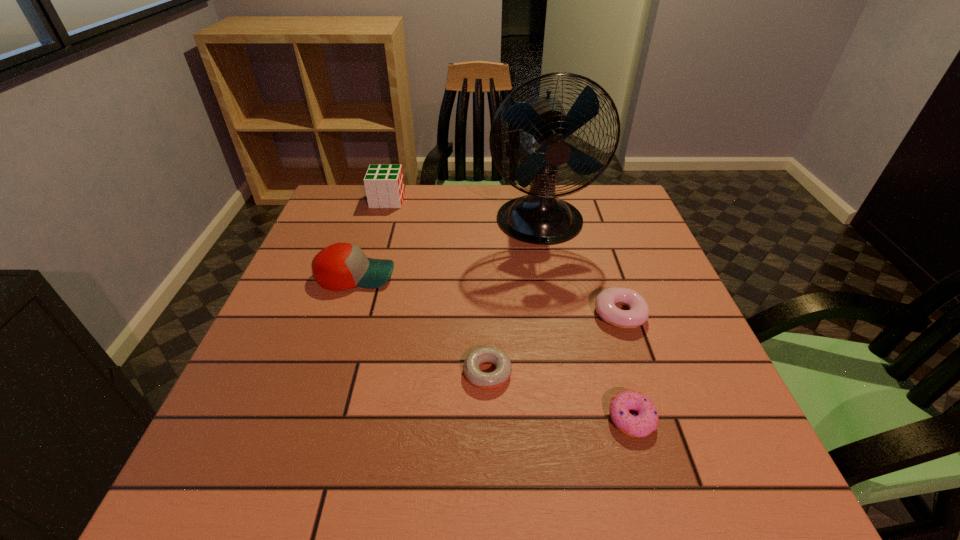
Identify the location of free space that satisfies the following two spatial constraints: 1. at the brim of the fourth shortest object; 2. on the right side of the nearest object. The height and width of the screenshot is (540, 960). (309, 418).

The width and height of the screenshot is (960, 540). Find the location of `vacant space that satisfies the following two spatial constraints: 1. on the front side of the nearest doughnut; 2. on the left side of the second nearest doughnut`. vacant space that satisfies the following two spatial constraints: 1. on the front side of the nearest doughnut; 2. on the left side of the second nearest doughnut is located at coordinates (488, 418).

The width and height of the screenshot is (960, 540). I want to click on free space in the image that satisfies the following two spatial constraints: 1. on the back side of the nearest doughnut; 2. on the red face of the cube, so click(568, 200).

At what (x,y) coordinates should I click in order to perform the action: click on free space that satisfies the following two spatial constraints: 1. on the front-facing side of the nearest object; 2. on the left side of the fan. Please return your answer as a coordinate pair (x, y). The height and width of the screenshot is (540, 960). Looking at the image, I should click on (576, 418).

Locate an element on the screen. This screenshot has height=540, width=960. vacant space that satisfies the following two spatial constraints: 1. on the front-facing side of the tallest object; 2. at the brim of the baseball cap is located at coordinates (550, 275).

Where is `free region that satisfies the following two spatial constraints: 1. at the brim of the fourth nearest object; 2. on the back side of the nearest doughnut`? free region that satisfies the following two spatial constraints: 1. at the brim of the fourth nearest object; 2. on the back side of the nearest doughnut is located at coordinates (309, 418).

The image size is (960, 540). Identify the location of free space that satisfies the following two spatial constraints: 1. on the back side of the fifth farthest object; 2. at the brim of the baseball cap. (486, 275).